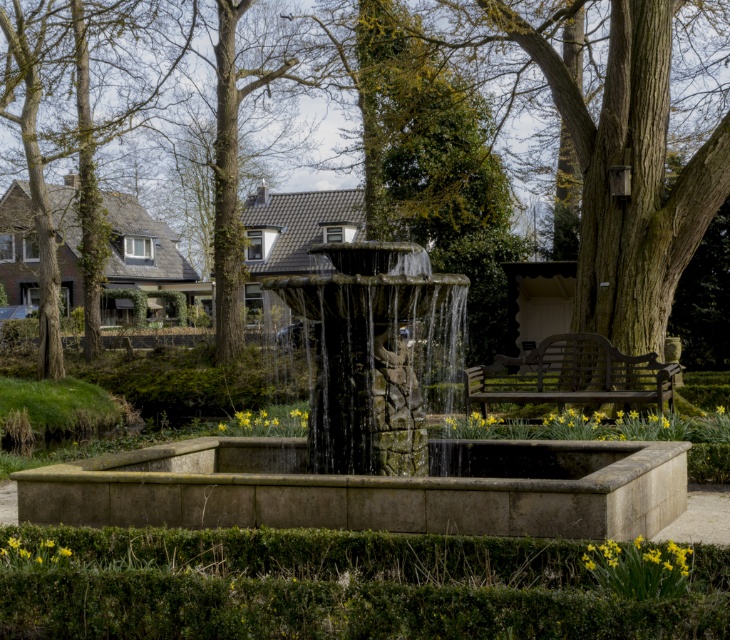
You are standing at the center of the image and want to walk towards the green leafy tree at center. In which direction should you move?

The green leafy tree at center is located at point coordinates (622, 145), so you should move towards the lower left direction from the center to reach it.

You are standing in the garden and want to water the vibrant yellow flowers. To reach them, you need to pass between the stone fountain at center and the stone textured fountain at center. Is there enough space between them to walk through comfortably?

The stone fountain at center is located below the stone textured fountain at center, meaning they are positioned one above the other vertically. Since they are stacked vertically, there is no horizontal space between them for walking through. You would need to go around them instead.